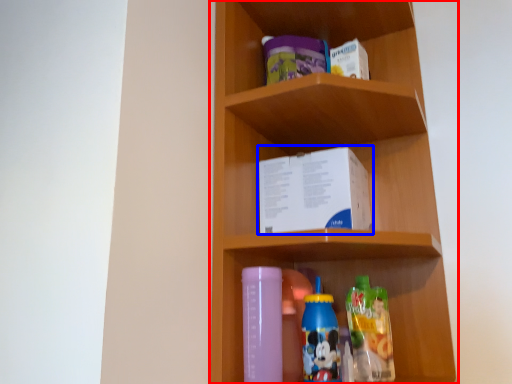
Question: Among these objects, which one is farthest to the camera, shelf (highlighted by a red box) or book (highlighted by a blue box)?

Choices:
 (A) shelf
 (B) book

Answer: (B)